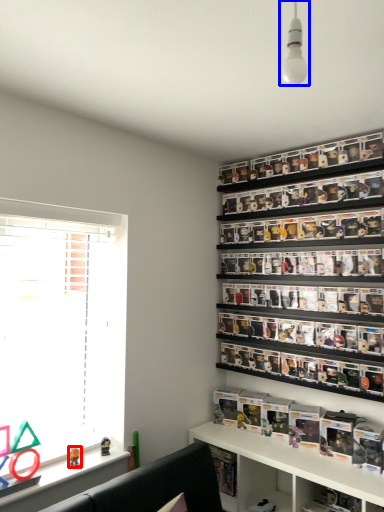
Question: Which object is closer to the camera taking this photo, toy (highlighted by a red box) or light fixture (highlighted by a blue box)?

Choices:
 (A) toy
 (B) light fixture

Answer: (B)